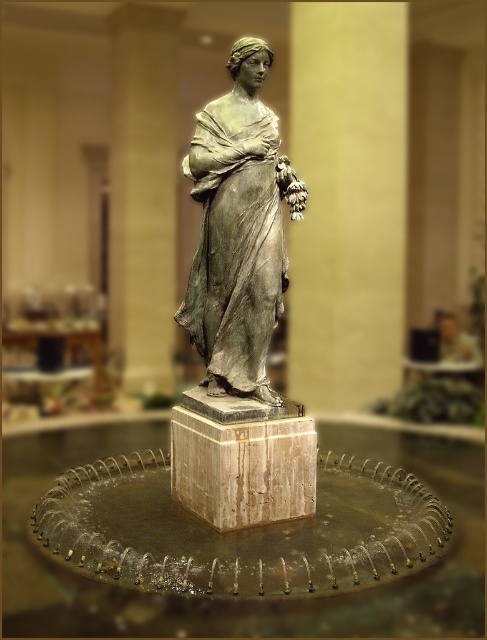
Is green patina bronze statue at center thinner than marble pedestal at center?

Yes, green patina bronze statue at center is thinner than marble pedestal at center.

Does green patina bronze statue at center have a smaller size compared to marble pedestal at center?

Actually, green patina bronze statue at center might be larger than marble pedestal at center.

The height and width of the screenshot is (640, 487). What are the coordinates of `green patina bronze statue at center` in the screenshot? It's located at (239, 230).

Identify the location of green patina bronze statue at center. [239, 230].